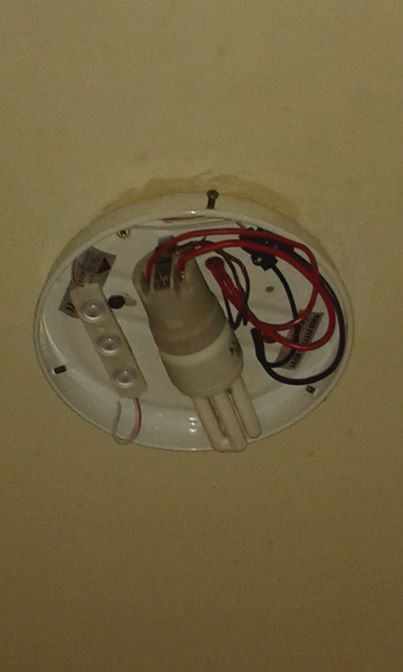
What are the coordinates of `black wires` in the screenshot? It's located at (283, 378).